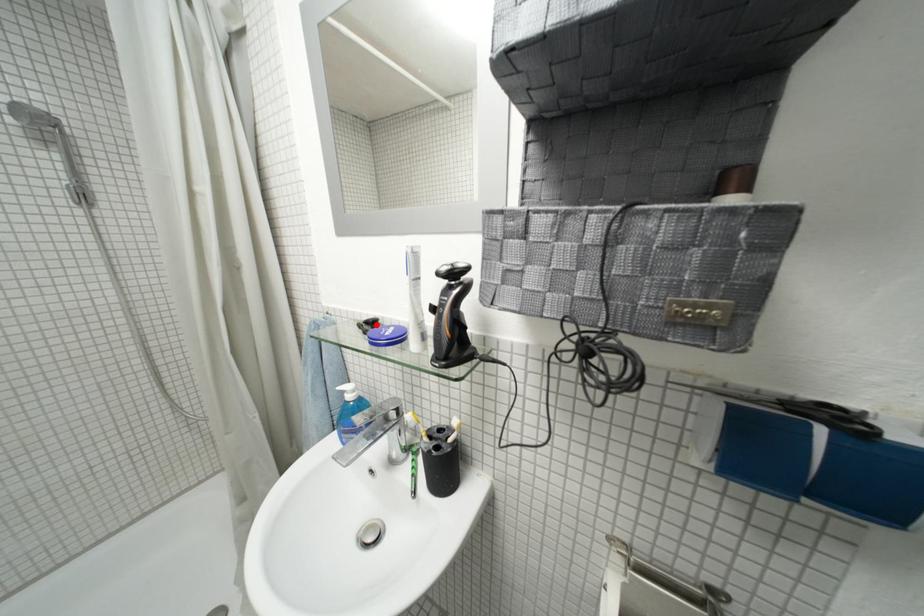
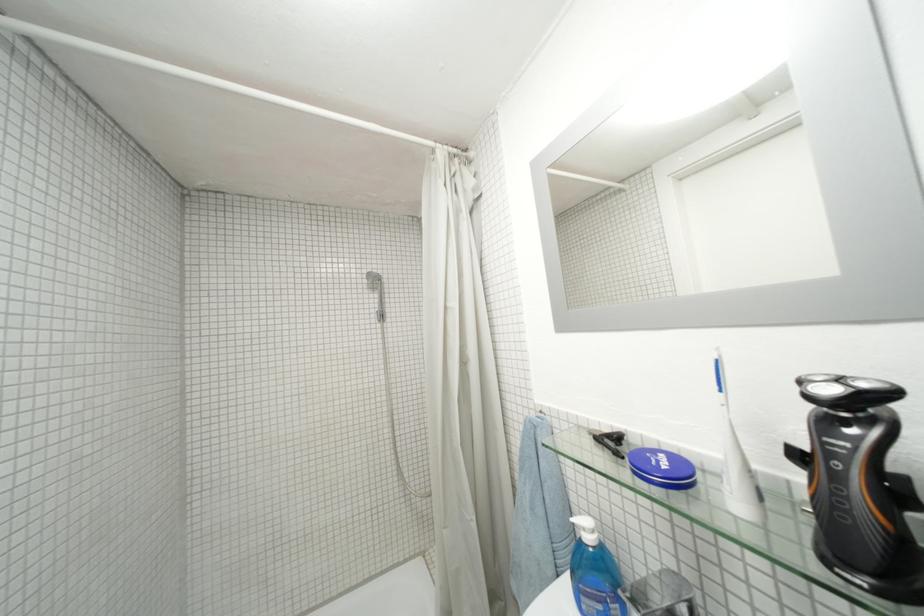
Locate, in the second image, the point that corresponds to the highlighted location in the first image.

(617, 439)